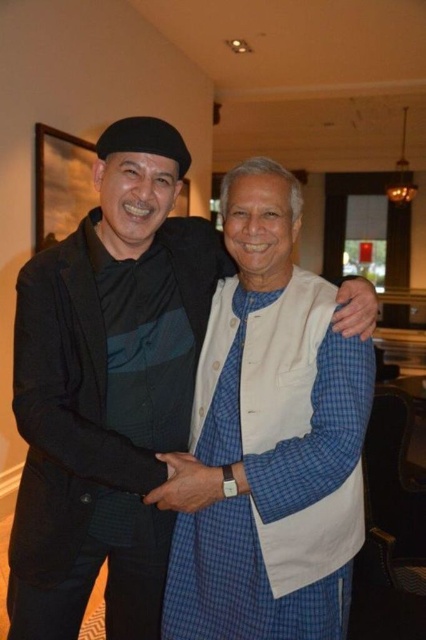
Can you confirm if blue checkered kurta at center is smaller than wooden frame at upper left?

No.

Between point (109, 406) and point (63, 141), which one is positioned in front?

Point (109, 406) is more forward.

Which is in front, point (46, 493) or point (36, 252)?

Point (46, 493) is more forward.

This screenshot has width=426, height=640. What are the coordinates of `blue checkered kurta at center` in the screenshot? It's located at (108, 388).

Does blue checkered kurta at center appear on the right side of white cotton apron at center?

No, blue checkered kurta at center is not to the right of white cotton apron at center.

Is blue checkered kurta at center bigger than white cotton apron at center?

Indeed, blue checkered kurta at center has a larger size compared to white cotton apron at center.

Is point (40, 576) positioned behind point (290, 321)?

Yes, point (40, 576) is behind point (290, 321).

Where is `blue checkered kurta at center`? The image size is (426, 640). blue checkered kurta at center is located at coordinates (108, 388).

In the scene shown: Can you confirm if white cotton apron at center is positioned below wooden frame at upper left?

Yes, white cotton apron at center is below wooden frame at upper left.

Image resolution: width=426 pixels, height=640 pixels. What are the coordinates of `white cotton apron at center` in the screenshot? It's located at click(x=273, y=470).